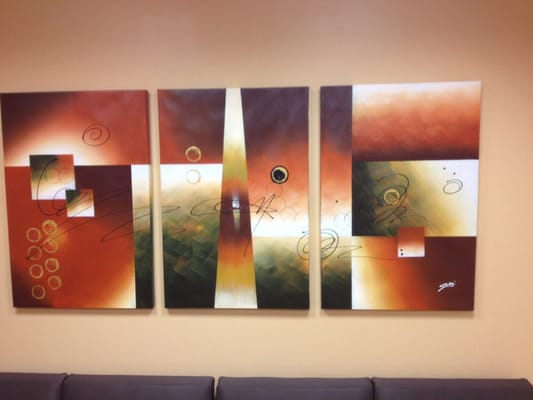
I want to click on four cushions, so click(x=401, y=385), click(x=324, y=392), click(x=189, y=391), click(x=38, y=381).